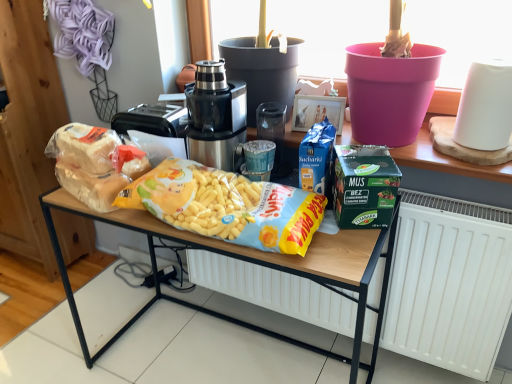
Identify the location of yellow matte corn sticks at center. (249, 262).

Find the location of `satin black juicer at center`. satin black juicer at center is located at coordinates (215, 116).

This screenshot has width=512, height=384. Find the location of `green matte lunch box at center`. green matte lunch box at center is located at coordinates tap(365, 186).

The width and height of the screenshot is (512, 384). I want to click on yellow matte corn sticks at center, so click(x=249, y=262).

Can you confirm if yellow matte corn at center, which ranks as the first cereal in right-to-left order, is bigger than yellow matte corn sticks at center?

No.

From a real-world perspective, is yellow matte corn at center, which appears as the 2th cereal when viewed from the left, beneath yellow matte corn sticks at center?

Incorrect, from a real-world perspective, yellow matte corn at center, which appears as the 2th cereal when viewed from the left, is higher than yellow matte corn sticks at center.

From the image's perspective, would you say yellow matte corn at center, which appears as the 2th cereal when viewed from the left, is positioned over yellow matte corn sticks at center?

Yes, from the image's perspective, yellow matte corn at center, which appears as the 2th cereal when viewed from the left, is on top of yellow matte corn sticks at center.

Could you tell me if yellow matte corn at center, which appears as the 2th cereal when viewed from the left, is turned towards yellow matte corn sticks at center?

No, yellow matte corn at center, which appears as the 2th cereal when viewed from the left, is not turned towards yellow matte corn sticks at center.

Is yellow matte corn sticks at center next to green matte lunch box at center and touching it?

There is a gap between yellow matte corn sticks at center and green matte lunch box at center.

Between yellow matte corn sticks at center and green matte lunch box at center, which one has larger width?

Wider between the two is yellow matte corn sticks at center.

From the image's perspective, would you say yellow matte corn sticks at center is shown under green matte lunch box at center?

Yes.

Between yellow matte corn sticks at center and green matte lunch box at center, which one has larger size?

Bigger between the two is yellow matte corn sticks at center.

Looking at their sizes, would you say satin black juicer at center is wider or thinner than white matte radiator at lower center?

satin black juicer at center is wider than white matte radiator at lower center.

The height and width of the screenshot is (384, 512). I want to click on radiator below the satin black juicer at center (from the image's perspective), so click(449, 283).

From the image's perspective, which is below, satin black juicer at center or white matte radiator at lower center?

white matte radiator at lower center, from the image's perspective.

From the image's perspective, is translucent plastic bag of bread at left, which is the 2th cereal from right to left, on satin black juicer at center?

Incorrect, from the image's perspective, translucent plastic bag of bread at left, which is the 2th cereal from right to left, is lower than satin black juicer at center.

Is translucent plastic bag of bread at left, which ranks as the first cereal in left-to-right order, facing towards satin black juicer at center?

No, translucent plastic bag of bread at left, which ranks as the first cereal in left-to-right order, is not oriented towards satin black juicer at center.

Which is more to the left, translucent plastic bag of bread at left, which is the 2th cereal from right to left, or satin black juicer at center?

Positioned to the left is translucent plastic bag of bread at left, which is the 2th cereal from right to left.

Between translucent plastic bag of bread at left, which ranks as the first cereal in left-to-right order, and satin black juicer at center, which one has smaller width?

With smaller width is translucent plastic bag of bread at left, which ranks as the first cereal in left-to-right order.

Based on their positions, is white matte radiator at lower center located to the left or right of green matte lunch box at center?

From the image, it's evident that white matte radiator at lower center is to the left of green matte lunch box at center.

Considering the relative sizes of white matte radiator at lower center and green matte lunch box at center in the image provided, is white matte radiator at lower center shorter than green matte lunch box at center?

In fact, white matte radiator at lower center may be taller than green matte lunch box at center.

From a real-world perspective, relative to green matte lunch box at center, is white matte radiator at lower center vertically above or below?

From a real-world perspective, white matte radiator at lower center is physically below green matte lunch box at center.

Is yellow matte corn sticks at center located outside translucent plastic bag of bread at left, which ranks as the first cereal in left-to-right order?

yellow matte corn sticks at center is positioned outside translucent plastic bag of bread at left, which ranks as the first cereal in left-to-right order.

Is yellow matte corn sticks at center looking in the opposite direction of translucent plastic bag of bread at left, which ranks as the first cereal in left-to-right order?

No, translucent plastic bag of bread at left, which ranks as the first cereal in left-to-right order, is not at the back of yellow matte corn sticks at center.

Is point (156, 228) farther from viewer compared to point (106, 210)?

No, (156, 228) is closer to viewer.

From a real-world perspective, which is physically below, yellow matte corn sticks at center or satin black juicer at center?

From a 3D spatial view, yellow matte corn sticks at center is below.

Locate an element on the screen. desk that is below the satin black juicer at center (from the image's perspective) is located at coordinates coord(249,262).

Between yellow matte corn sticks at center and satin black juicer at center, which one has less height?

With less height is satin black juicer at center.

Is point (337, 237) positioned behind point (214, 118)?

No, it is in front of (214, 118).

Starting from the yellow matte corn sticks at center, which cereal is the 1st one behind? Please provide its 2D coordinates.

[(227, 206)]

Locate an element on the screen. The image size is (512, 384). desk lying in front of the green matte lunch box at center is located at coordinates (249, 262).

Looking at the image, which one is located closer to green matte lunch box at center, satin black juicer at center or yellow matte corn at center, which ranks as the first cereal in right-to-left order?

yellow matte corn at center, which ranks as the first cereal in right-to-left order, lies closer to green matte lunch box at center than the other object.

Looking at the image, which one is located further to green matte lunch box at center, translucent plastic bag of bread at left, which ranks as the first cereal in left-to-right order, or yellow matte corn sticks at center?

translucent plastic bag of bread at left, which ranks as the first cereal in left-to-right order, lies further to green matte lunch box at center than the other object.

When comparing their distances from yellow matte corn at center, which appears as the 2th cereal when viewed from the left, does yellow matte corn sticks at center or translucent plastic bag of bread at left, which is the 2th cereal from right to left, seem further?

translucent plastic bag of bread at left, which is the 2th cereal from right to left, is positioned further to the anchor yellow matte corn at center, which appears as the 2th cereal when viewed from the left.

Which object lies further to the anchor point green matte lunch box at center, white matte radiator at lower center or translucent plastic bag of bread at left, which ranks as the first cereal in left-to-right order?

translucent plastic bag of bread at left, which ranks as the first cereal in left-to-right order.

Estimate the real-world distances between objects in this image. Which object is further from white matte radiator at lower center, translucent plastic bag of bread at left, which is the 2th cereal from right to left, or green matte lunch box at center?

translucent plastic bag of bread at left, which is the 2th cereal from right to left.

From the image, which object appears to be farther from white matte radiator at lower center, yellow matte corn at center, which appears as the 2th cereal when viewed from the left, or yellow matte corn sticks at center?

Among the two, yellow matte corn at center, which appears as the 2th cereal when viewed from the left, is located further to white matte radiator at lower center.

Estimate the real-world distances between objects in this image. Which object is closer to yellow matte corn sticks at center, green matte lunch box at center or satin black juicer at center?

The object closer to yellow matte corn sticks at center is green matte lunch box at center.

From the image, which object appears to be nearer to yellow matte corn at center, which appears as the 2th cereal when viewed from the left, satin black juicer at center or yellow matte corn sticks at center?

satin black juicer at center.

Where is `cereal between translucent plastic bag of bread at left, which ranks as the first cereal in left-to-right order, and green matte lunch box at center`? The height and width of the screenshot is (384, 512). cereal between translucent plastic bag of bread at left, which ranks as the first cereal in left-to-right order, and green matte lunch box at center is located at coordinates (227, 206).

Locate an element on the screen. The width and height of the screenshot is (512, 384). cereal situated between translucent plastic bag of bread at left, which is the 2th cereal from right to left, and white matte radiator at lower center from left to right is located at coordinates (227, 206).

Find the location of a particular element. Image resolution: width=512 pixels, height=384 pixels. home appliance between translucent plastic bag of bread at left, which is the 2th cereal from right to left, and yellow matte corn at center, which ranks as the first cereal in right-to-left order, from left to right is located at coordinates (215, 116).

Locate an element on the screen. This screenshot has height=384, width=512. home appliance situated between translucent plastic bag of bread at left, which is the 2th cereal from right to left, and green matte lunch box at center from left to right is located at coordinates (215, 116).